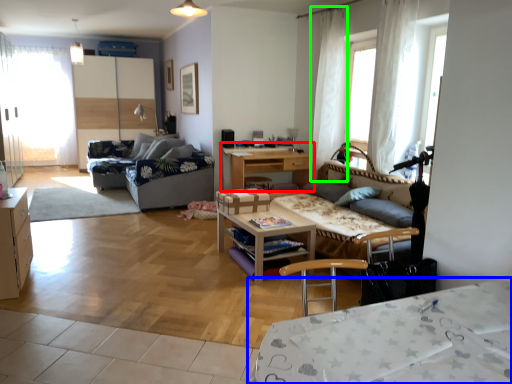
Question: Which is farther away from table (highlighted by a red box)? desk (highlighted by a blue box) or curtain (highlighted by a green box)?

Choices:
 (A) desk
 (B) curtain

Answer: (A)